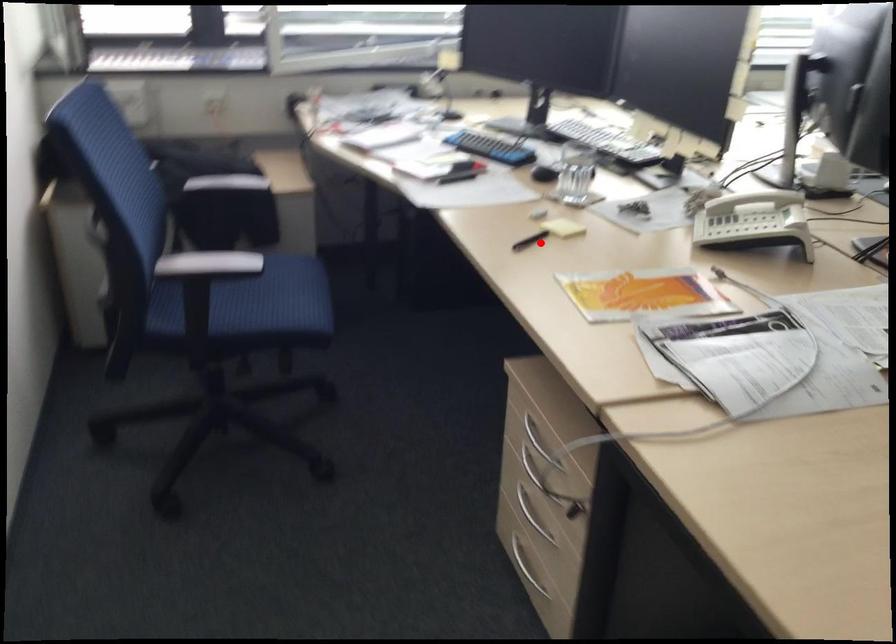
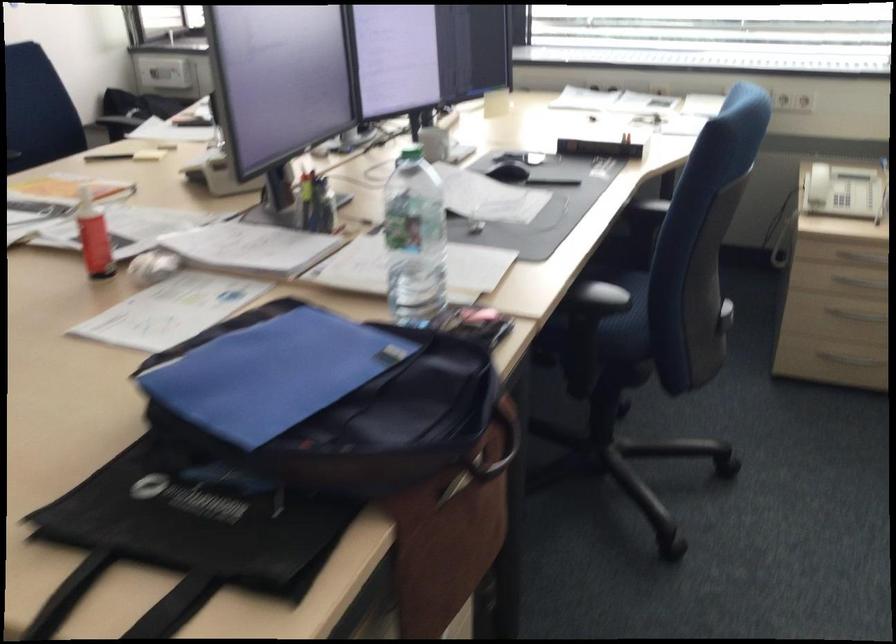
Question: I am providing you with two images of the same scene from different viewpoints. In image1, a red point is highlighted. Considering the same 3D point in image2, which of the following is correct?

Choices:
 (A) It is closer
 (B) It is farther

Answer: (B)